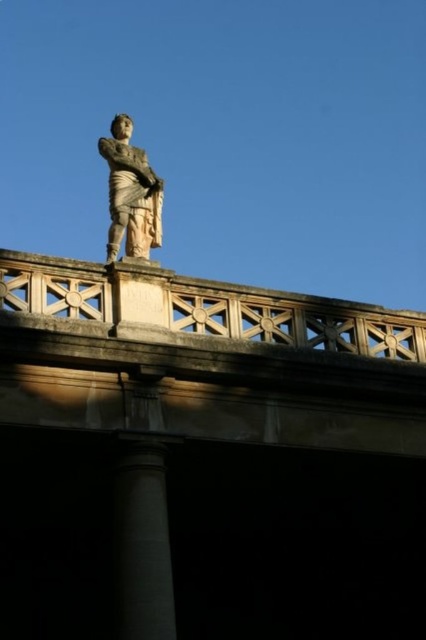
Question: Can you confirm if white stone bridge at upper center is thinner than smooth gray column at center?

Choices:
 (A) no
 (B) yes

Answer: (A)

Question: Which of the following is the farthest from the observer?

Choices:
 (A) smooth gray column at center
 (B) stone statue at center

Answer: (B)

Question: Does smooth gray column at center come behind stone statue at center?

Choices:
 (A) yes
 (B) no

Answer: (B)

Question: Considering the real-world distances, which object is farthest from the stone statue at center?

Choices:
 (A) white stone bridge at upper center
 (B) smooth gray column at center

Answer: (B)

Question: Which point is farther to the camera?

Choices:
 (A) (135, 605)
 (B) (152, 211)
 (C) (124, 586)

Answer: (B)

Question: Is smooth gray column at center smaller than stone statue at center?

Choices:
 (A) yes
 (B) no

Answer: (A)